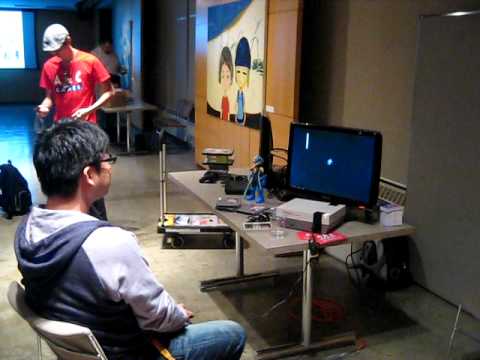
Where is `chair`? chair is located at coordinates (60, 334).